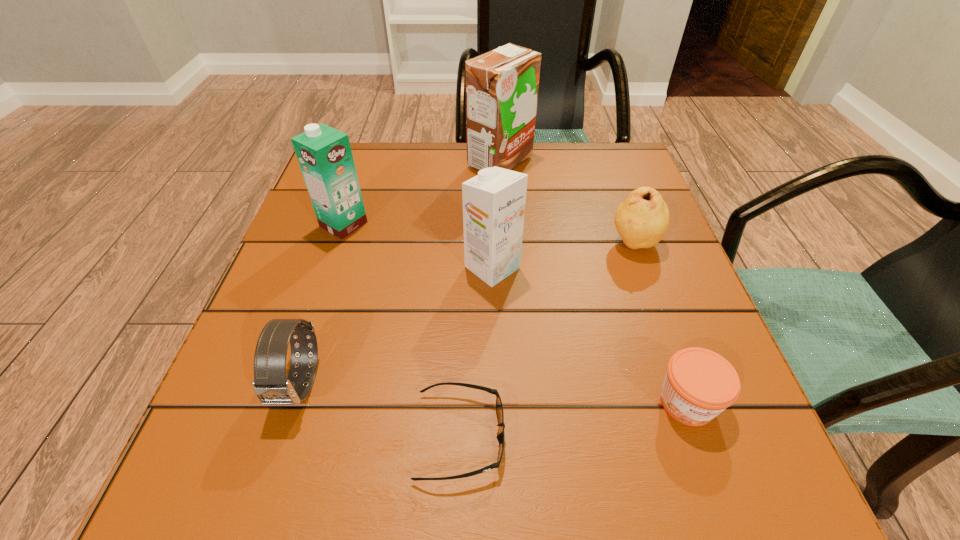
You are a GUI agent. You are given a task and a screenshot of the screen. Output one action in this format:
    pyautogui.click(x=<x>, y=<y>)
    Task: Click on the farthest object
    Image resolution: width=960 pixels, height=540 pixels.
    Given the screenshot: What is the action you would take?
    pyautogui.click(x=502, y=85)

The height and width of the screenshot is (540, 960). Find the location of `the tallest object`. the tallest object is located at coordinates (502, 85).

Identify the location of the second farthest carton. (324, 154).

Identify the location of the nearest carton. The width and height of the screenshot is (960, 540). (494, 201).

The width and height of the screenshot is (960, 540). What are the coordinates of `pear` in the screenshot? It's located at (641, 220).

This screenshot has width=960, height=540. In order to click on watch in this screenshot , I will do `click(271, 386)`.

Locate an element on the screen. jam is located at coordinates (699, 384).

In order to click on the shortest object in this screenshot , I will do 499,407.

I want to click on vacant region located 0.070m on the straw side of the farthest object, so click(438, 161).

You are a GUI agent. You are given a task and a screenshot of the screen. Output one action in this format:
    pyautogui.click(x=<x>, y=<y>)
    Task: Click on the free region located 0.310m on the straw side of the farthest object
    The height and width of the screenshot is (540, 960).
    Given the screenshot: What is the action you would take?
    pyautogui.click(x=339, y=161)